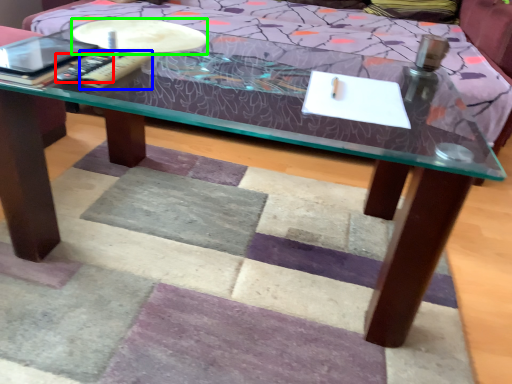
Question: Which object is the farthest from remote (highlighted by a red box)? Choose among these: remote (highlighted by a blue box) or round table (highlighted by a green box).

Choices:
 (A) remote
 (B) round table

Answer: (B)